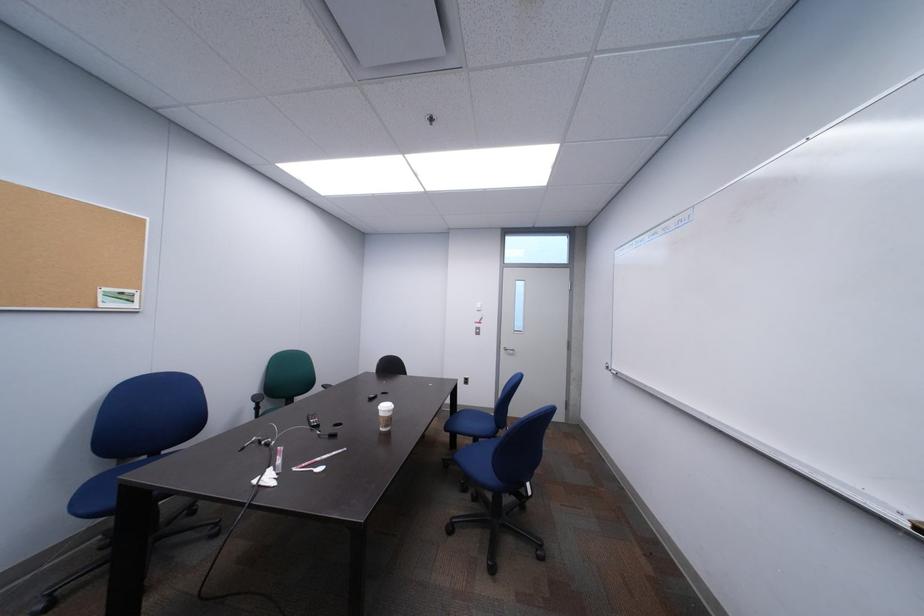
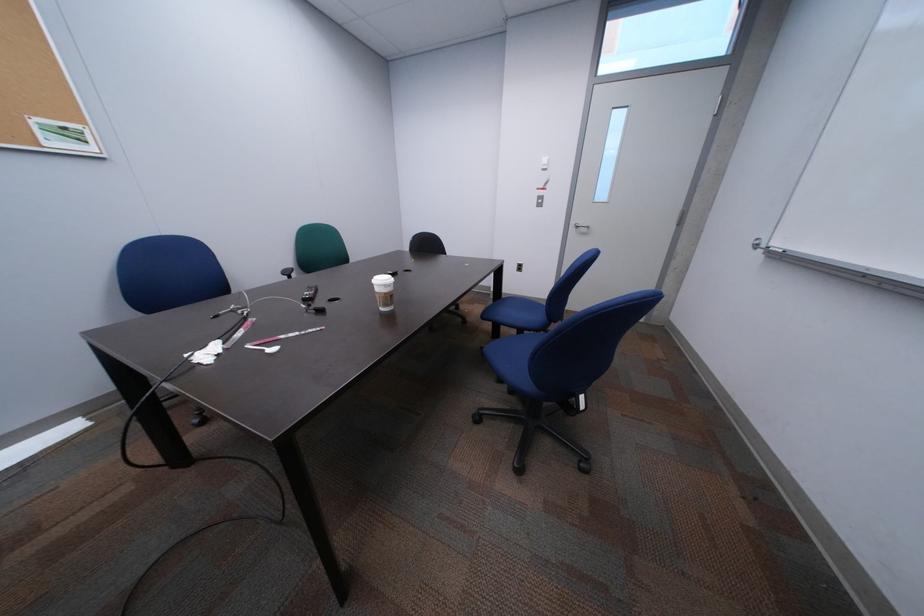
Question: Which direction would the cameraman need to move to produce the second image? Reply with the corresponding letter.

Choices:
 (A) Left
 (B) Right
 (C) Forward
 (D) Backward

Answer: (C)